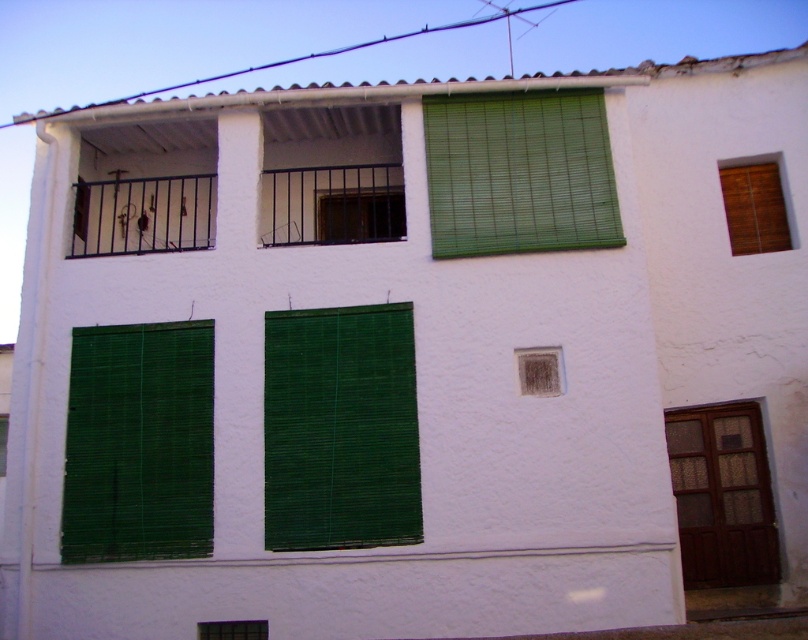
Question: Which point is farther to the camera?

Choices:
 (A) green bamboo blinds at lower center
 (B) green bamboo blinds at lower left
 (C) black metal railing at upper center

Answer: (C)

Question: In this image, where is green bamboo blinds at lower left located relative to black metal railing at upper center?

Choices:
 (A) left
 (B) right

Answer: (A)

Question: Considering the real-world distances, which object is farthest from the green bamboo blinds at lower center?

Choices:
 (A) green bamboo blinds at lower left
 (B) green bamboo curtain at center
 (C) green bamboo blinds at upper center

Answer: (C)

Question: Is green bamboo blinds at lower left bigger than green bamboo window at lower left?

Choices:
 (A) yes
 (B) no

Answer: (A)

Question: Based on their relative distances, which object is farther from the black metal railing at upper center?

Choices:
 (A) green bamboo window at lower left
 (B) green bamboo curtain at center

Answer: (A)

Question: Does green bamboo curtain at center lie behind wooden blinds at upper right?

Choices:
 (A) no
 (B) yes

Answer: (A)